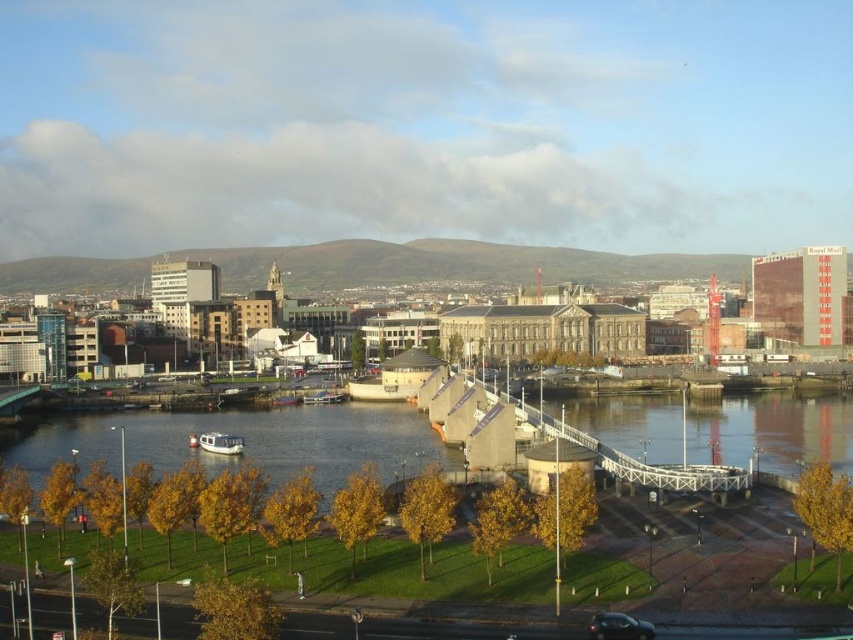
Who is more forward, (202,461) or (521,419)?

Point (521,419)

Is point (39, 442) closer to camera compared to point (538, 410)?

That is False.

You are a GUI agent. You are given a task and a screenshot of the screen. Output one action in this format:
    pyautogui.click(x=<x>, y=<y>)
    Task: Click on the clear water at lower center
    
    Given the screenshot: What is the action you would take?
    pyautogui.click(x=248, y=442)

Can you confirm if clear water at lower center is positioned above shiny black car at bottom right?

Yes, clear water at lower center is above shiny black car at bottom right.

Is point (163, 440) behind point (601, 624)?

Yes, point (163, 440) is behind point (601, 624).

Which is behind, point (329, 406) or point (631, 620)?

The point (329, 406) is more distant.

In order to click on clear water at lower center in this screenshot , I will do `click(248, 442)`.

Between white wooden bridge at center and shiny black car at bottom right, which one appears on the left side from the viewer's perspective?

shiny black car at bottom right

Is white wooden bridge at center bigger than shiny black car at bottom right?

Correct, white wooden bridge at center is larger in size than shiny black car at bottom right.

The height and width of the screenshot is (640, 853). In order to click on white wooden bridge at center in this screenshot , I will do `click(639, 460)`.